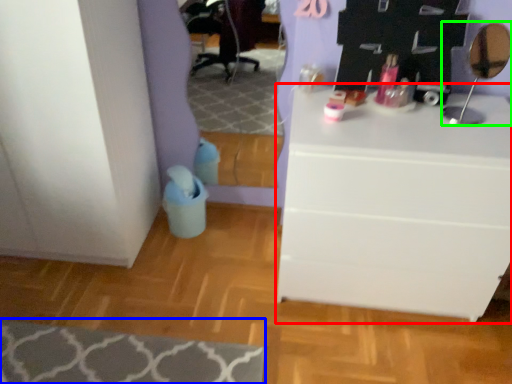
Question: Estimate the real-world distances between objects in this image. Which object is farther from chest of drawers (highlighted by a red box), mat (highlighted by a blue box) or mirror (highlighted by a green box)?

Choices:
 (A) mat
 (B) mirror

Answer: (A)